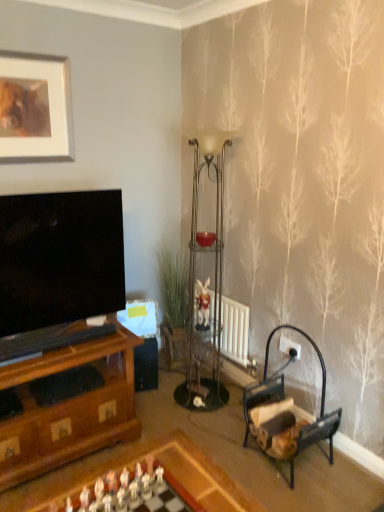
The height and width of the screenshot is (512, 384). Identify the location of free space to the left of wooden armchair at lower right. (228, 451).